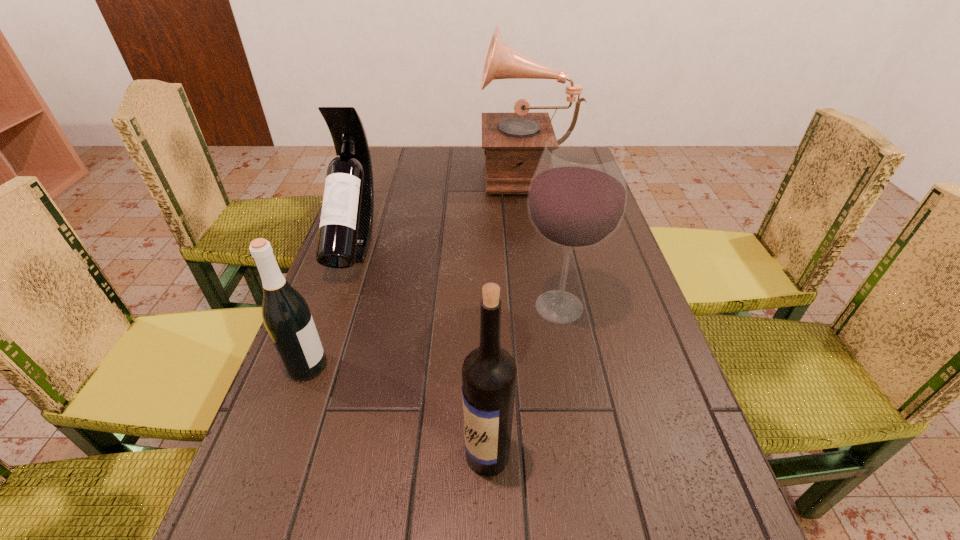
Identify the location of free location that satisfies the following two spatial constraints: 1. on the horn of the alcohol; 2. on the left side of the farthest object. (548, 307).